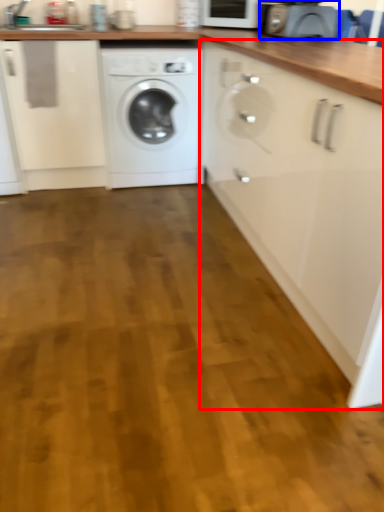
Question: Which object is closer to the camera taking this photo, cabinetry (highlighted by a red box) or appliance (highlighted by a blue box)?

Choices:
 (A) cabinetry
 (B) appliance

Answer: (A)